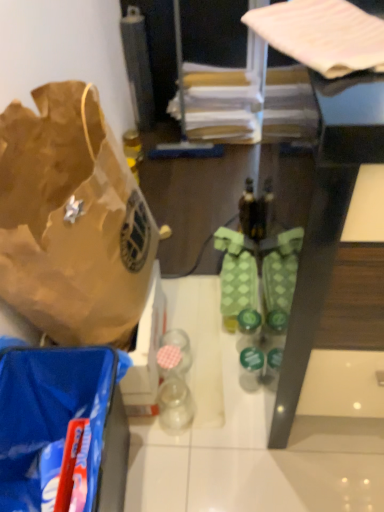
Question: Is pink fabric at upper right, the 1th wrapping paper in the front-to-back sequence, at the right side of blue plastic bag at lower left?

Choices:
 (A) yes
 (B) no

Answer: (A)

Question: Could you tell me if pink fabric at upper right, which is counted as the first wrapping paper, starting from the bottom, is facing blue plastic bag at lower left?

Choices:
 (A) yes
 (B) no

Answer: (B)

Question: Can you see pink fabric at upper right, arranged as the 2th wrapping paper when viewed from the back, touching blue plastic bag at lower left?

Choices:
 (A) yes
 (B) no

Answer: (B)

Question: From the image's perspective, does pink fabric at upper right, placed as the second wrapping paper when sorted from top to bottom, appear higher than blue plastic bag at lower left?

Choices:
 (A) yes
 (B) no

Answer: (A)

Question: From a real-world perspective, is pink fabric at upper right, arranged as the 2th wrapping paper when viewed from the back, beneath blue plastic bag at lower left?

Choices:
 (A) yes
 (B) no

Answer: (B)

Question: From the image's perspective, does pink fabric at upper right, the 1th wrapping paper in the front-to-back sequence, appear lower than blue plastic bag at lower left?

Choices:
 (A) yes
 (B) no

Answer: (B)

Question: Could you tell me if brown paper bag at left is turned towards matte brown wrapping paper at upper center, the second wrapping paper in the front-to-back sequence?

Choices:
 (A) no
 (B) yes

Answer: (A)

Question: Can you confirm if brown paper bag at left is shorter than matte brown wrapping paper at upper center, which is the 1th wrapping paper in top-to-bottom order?

Choices:
 (A) no
 (B) yes

Answer: (A)

Question: Could matte brown wrapping paper at upper center, which is the 1th wrapping paper in top-to-bottom order, be considered to be inside brown paper bag at left?

Choices:
 (A) no
 (B) yes

Answer: (A)

Question: Is brown paper bag at left turned away from matte brown wrapping paper at upper center, the second wrapping paper in the front-to-back sequence?

Choices:
 (A) no
 (B) yes

Answer: (A)

Question: Can you confirm if brown paper bag at left is taller than matte brown wrapping paper at upper center, which is the 1th wrapping paper in top-to-bottom order?

Choices:
 (A) no
 (B) yes

Answer: (B)

Question: From the image's perspective, is brown paper bag at left under matte brown wrapping paper at upper center, which is the 1th wrapping paper in top-to-bottom order?

Choices:
 (A) yes
 (B) no

Answer: (A)

Question: Is matte brown wrapping paper at upper center, marked as the 2th wrapping paper in a bottom-to-top arrangement, smaller than brown paper bag at left?

Choices:
 (A) no
 (B) yes

Answer: (B)